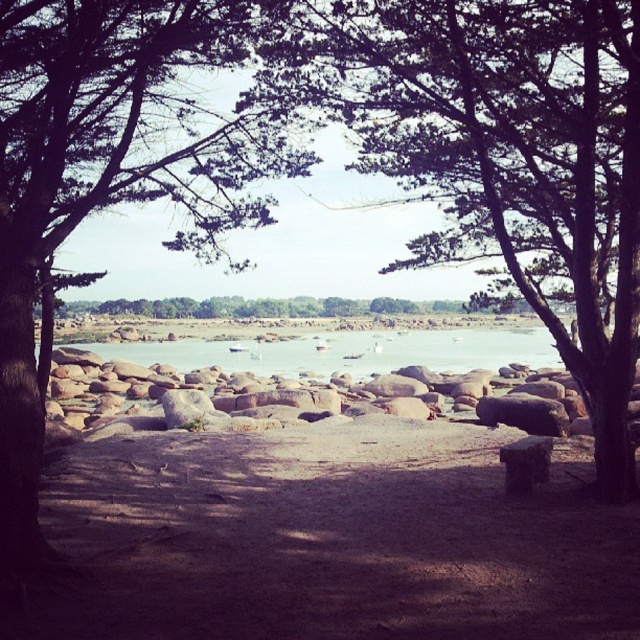
Is green leafy tree at center smaller than clear water at center?

Actually, green leafy tree at center might be larger than clear water at center.

Is point (460, 227) positioned before point (426, 365)?

Yes, it is in front of point (426, 365).

The width and height of the screenshot is (640, 640). What are the coordinates of `green leafy tree at center` in the screenshot? It's located at (497, 154).

Does brown sandy dirt at center come behind clear water at center?

No, it is in front of clear water at center.

Is brown sandy dirt at center bigger than clear water at center?

No, brown sandy dirt at center is not bigger than clear water at center.

Where is `brown sandy dirt at center`? This screenshot has height=640, width=640. brown sandy dirt at center is located at coordinates (330, 540).

In order to click on brown sandy dirt at center in this screenshot , I will do `click(330, 540)`.

Who is positioned more to the left, green leafy tree at center or green leafy tree at left?

From the viewer's perspective, green leafy tree at left appears more on the left side.

Is point (337, 36) behind point (35, 486)?

Yes, point (337, 36) is farther from viewer.

Who is more forward, (474,33) or (83,124)?

Point (83,124) is in front.

Identify the location of green leafy tree at center. (497, 154).